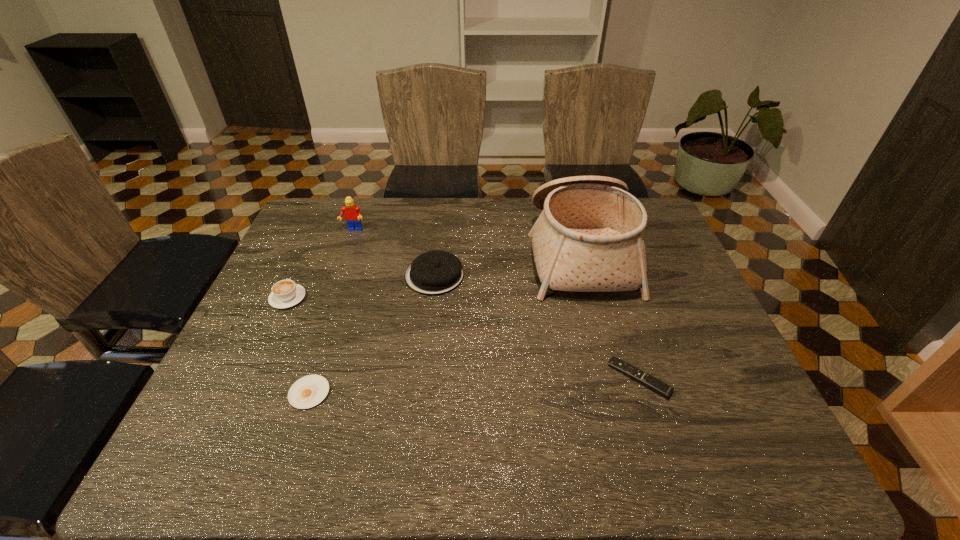
Where is `object that ranks as the fifth closest to the cappuccino`? The image size is (960, 540). object that ranks as the fifth closest to the cappuccino is located at coordinates (654, 384).

You are a GUI agent. You are given a task and a screenshot of the screen. Output one action in this format:
    pyautogui.click(x=<x>, y=<y>)
    Task: Click on the free space that satisfies the following two spatial constraints: 1. on the front-facing side of the egg yolk; 2. on the left side of the Lego
    The image size is (960, 540).
    Given the screenshot: What is the action you would take?
    pyautogui.click(x=295, y=393)

The width and height of the screenshot is (960, 540). In order to click on free point that satisfies the following two spatial constraints: 1. on the front-facing side of the fifth tallest object; 2. on the left side of the fifth shortest object in this screenshot , I will do `click(300, 378)`.

Locate an element on the screen. Image resolution: width=960 pixels, height=540 pixels. vacant space that satisfies the following two spatial constraints: 1. with the lid open on the basket; 2. on the front side of the shortest object is located at coordinates (617, 393).

Identify the location of free space that satisfies the following two spatial constraints: 1. on the side of the fourth object from left to right with the handle; 2. on the left side of the third shortest object. The image size is (960, 540). (299, 275).

Locate an element on the screen. The height and width of the screenshot is (540, 960). free space that satisfies the following two spatial constraints: 1. on the front-facing side of the fifth shortest object; 2. on the right side of the pancake is located at coordinates click(337, 275).

Where is `blank area in the image that satisfies the following two spatial constraints: 1. with the lid open on the basket; 2. on the front side of the egg yolk`? This screenshot has height=540, width=960. blank area in the image that satisfies the following two spatial constraints: 1. with the lid open on the basket; 2. on the front side of the egg yolk is located at coordinates (617, 393).

Identify the location of free space that satisfies the following two spatial constraints: 1. on the front-facing side of the second shortest object; 2. on the left side of the Lego. This screenshot has width=960, height=540. click(x=300, y=378).

Locate an element on the screen. free space that satisfies the following two spatial constraints: 1. on the front-facing side of the fifth shortest object; 2. on the left side of the shortest object is located at coordinates (295, 393).